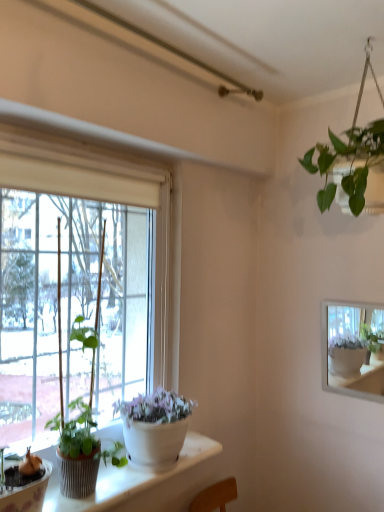
Find the location of a particular element. This screenshot has height=512, width=384. free space above transparent glass window at left (from a real-world perspective) is located at coordinates (73, 129).